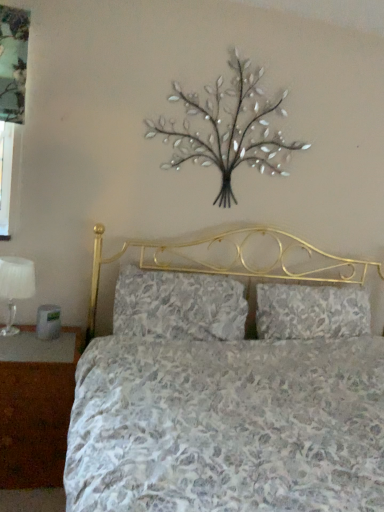
What are the coordinates of `unoccupied region to the right of white fabric lampshade at left` in the screenshot? It's located at pyautogui.click(x=38, y=338).